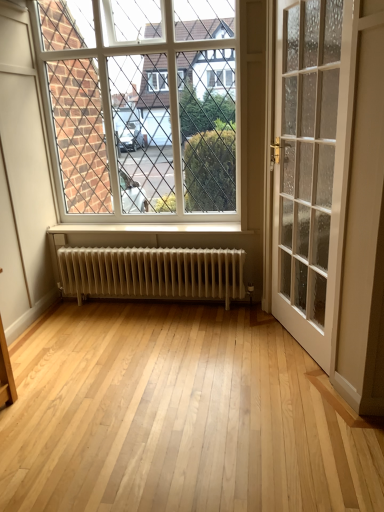
Question: From a real-world perspective, is white glass window at upper center located beneath white metallic radiator at center?

Choices:
 (A) no
 (B) yes

Answer: (A)

Question: From a real-world perspective, is white glass window at upper center located higher than white metallic radiator at center?

Choices:
 (A) no
 (B) yes

Answer: (B)

Question: From the image's perspective, would you say white glass window at upper center is positioned over white metallic radiator at center?

Choices:
 (A) no
 (B) yes

Answer: (B)

Question: Could you tell me if white glass window at upper center is turned towards white metallic radiator at center?

Choices:
 (A) no
 (B) yes

Answer: (A)

Question: Is white glass window at upper center not within white metallic radiator at center?

Choices:
 (A) no
 (B) yes

Answer: (B)

Question: In terms of width, does white glass window at upper center look wider or thinner when compared to white metallic radiator at center?

Choices:
 (A) wide
 (B) thin

Answer: (B)

Question: Would you say white glass window at upper center is to the left or to the right of white metallic radiator at center in the picture?

Choices:
 (A) right
 (B) left

Answer: (B)

Question: From the image's perspective, relative to white metallic radiator at center, is white glass window at upper center above or below?

Choices:
 (A) above
 (B) below

Answer: (A)

Question: Considering the positions of white glass window at upper center and white metallic radiator at center in the image, is white glass window at upper center bigger or smaller than white metallic radiator at center?

Choices:
 (A) big
 (B) small

Answer: (A)

Question: From a real-world perspective, is white glass window at upper center positioned above or below white glass door at right?

Choices:
 (A) above
 (B) below

Answer: (A)

Question: In the image, is white glass window at upper center positioned in front of or behind white glass door at right?

Choices:
 (A) behind
 (B) front

Answer: (A)

Question: Is point (104, 48) positioned closer to the camera than point (309, 246)?

Choices:
 (A) farther
 (B) closer

Answer: (A)

Question: Would you say white glass window at upper center is inside or outside white glass door at right?

Choices:
 (A) inside
 (B) outside

Answer: (B)

Question: Considering their positions, is white glass door at right located in front of or behind white metallic radiator at center?

Choices:
 (A) front
 (B) behind

Answer: (A)

Question: In terms of width, does white glass door at right look wider or thinner when compared to white metallic radiator at center?

Choices:
 (A) wide
 (B) thin

Answer: (B)